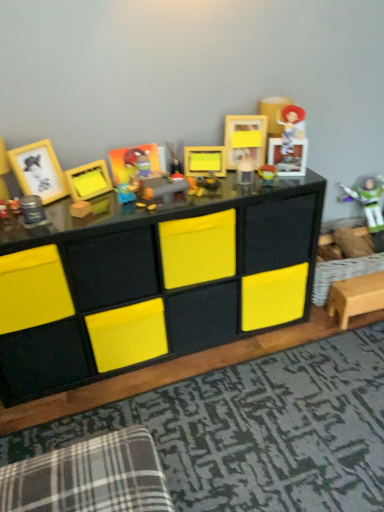
Identify the location of free location to the right of matte yellow plush toy at center, marked as the 2th toy in a left-to-right arrangement. This screenshot has width=384, height=512. (177, 197).